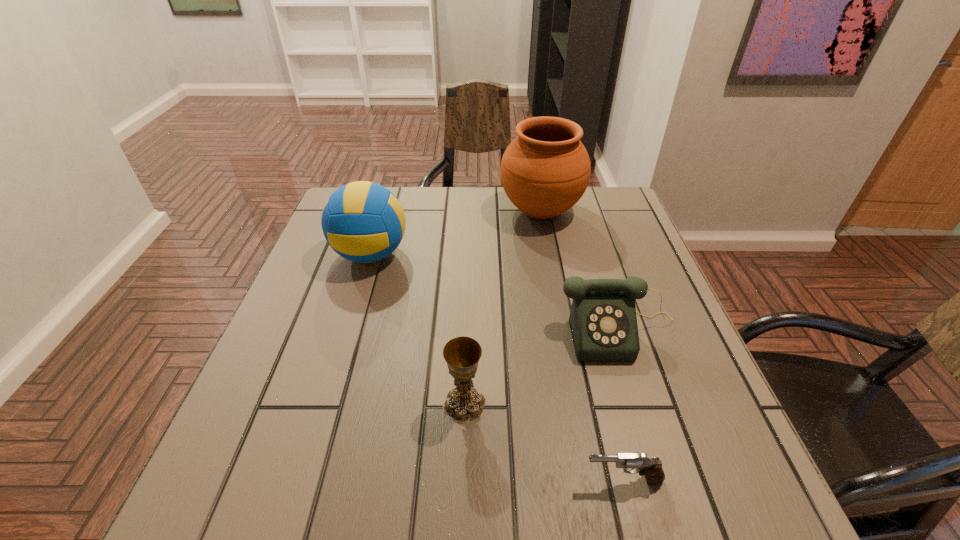
This screenshot has width=960, height=540. Find the location of `vacant area located on the back of the leftmost object`. vacant area located on the back of the leftmost object is located at coordinates (387, 200).

Where is `vacant space located on the back of the third shortest object`? This screenshot has height=540, width=960. vacant space located on the back of the third shortest object is located at coordinates (467, 338).

The width and height of the screenshot is (960, 540). I want to click on vacant region located 0.240m on the dial of the second shortest object, so click(x=667, y=486).

Find the location of `vacant point located at the barrel of the shortest object`. vacant point located at the barrel of the shortest object is located at coordinates (374, 480).

Locate an element on the screen. vacant space situated 0.400m at the barrel of the shortest object is located at coordinates (329, 480).

You are a GUI agent. You are given a task and a screenshot of the screen. Output one action in this format:
    pyautogui.click(x=<x>, y=<y>)
    Task: Click on the vacant space situated at the barrel of the shortest object
    Image resolution: width=960 pixels, height=540 pixels.
    Given the screenshot: What is the action you would take?
    pyautogui.click(x=494, y=480)

This screenshot has width=960, height=540. In order to click on object located at the far edge in this screenshot , I will do `click(545, 170)`.

Find the location of `object that is positioned at the near edge`. object that is positioned at the near edge is located at coordinates (651, 467).

At what (x,y) coordinates should I click in order to perform the action: click on object present at the left edge. Please return your answer as a coordinate pair (x, y). The height and width of the screenshot is (540, 960). Looking at the image, I should click on (362, 221).

This screenshot has width=960, height=540. I want to click on pottery that is at the right edge, so click(x=545, y=170).